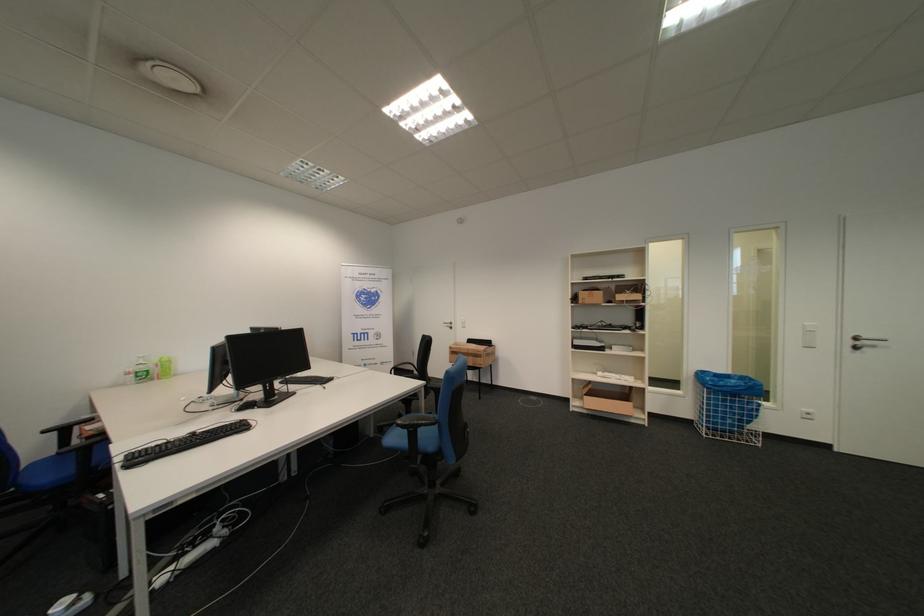
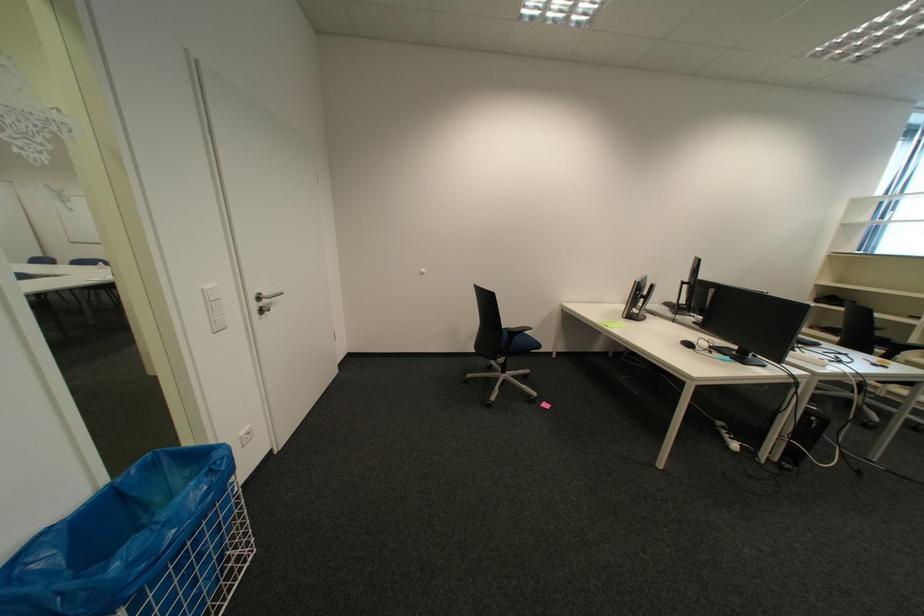
Where in the second image is the point corresponding to (819,325) from the first image?

(217, 288)